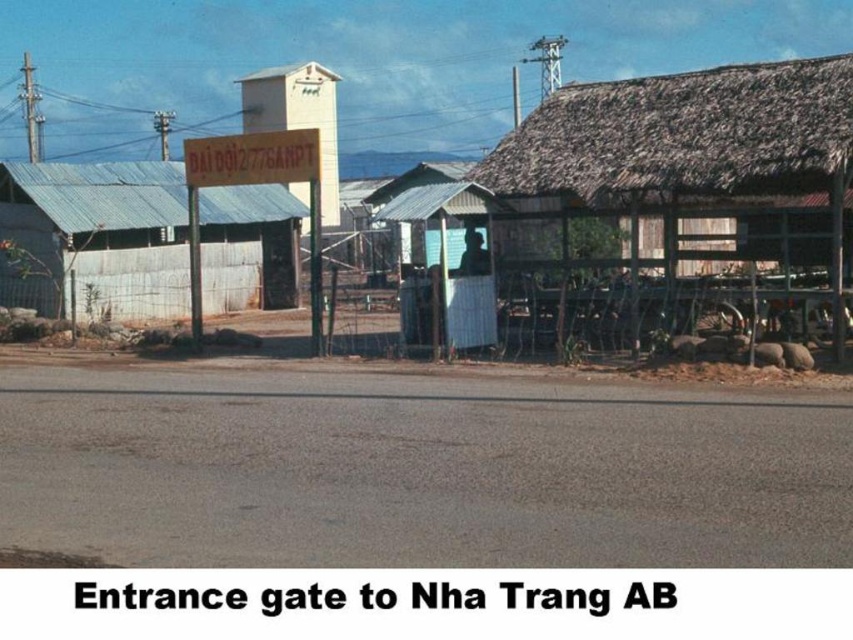
Who is higher up, thatched roof hut at right or metal corrugated roof hut at left?

thatched roof hut at right is higher up.

Who is shorter, thatched roof hut at right or metal corrugated roof hut at left?

With less height is thatched roof hut at right.

Which is in front, point (726, 122) or point (113, 205)?

Point (726, 122) is more forward.

The image size is (853, 640). In order to click on thatched roof hut at right in this screenshot , I will do `click(682, 134)`.

Is metal corrugated roof at upper center wider than thatched roof hut at right?

Correct, the width of metal corrugated roof at upper center exceeds that of thatched roof hut at right.

How much distance is there between metal corrugated roof at upper center and thatched roof hut at right?

metal corrugated roof at upper center is 34.62 inches away from thatched roof hut at right.

Who is more distant from viewer, (635,90) or (497,148)?

The point (497,148) is more distant.

At what (x,y) coordinates should I click in order to perform the action: click on metal corrugated roof at upper center. Please return your answer as a coordinate pair (x, y). Looking at the image, I should click on (682, 152).

Does metal corrugated roof at upper center have a greater width compared to metal corrugated roof hut at left?

Correct, the width of metal corrugated roof at upper center exceeds that of metal corrugated roof hut at left.

Can you confirm if metal corrugated roof at upper center is bigger than metal corrugated roof hut at left?

Yes.

Locate an element on the screen. This screenshot has width=853, height=640. metal corrugated roof at upper center is located at coordinates tap(682, 152).